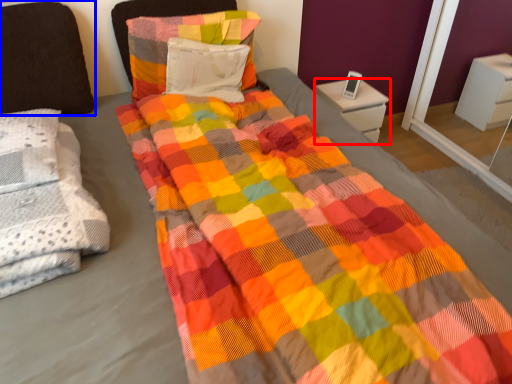
Question: Which object is closer to the camera taking this photo, nightstand (highlighted by a red box) or pillow (highlighted by a blue box)?

Choices:
 (A) nightstand
 (B) pillow

Answer: (B)